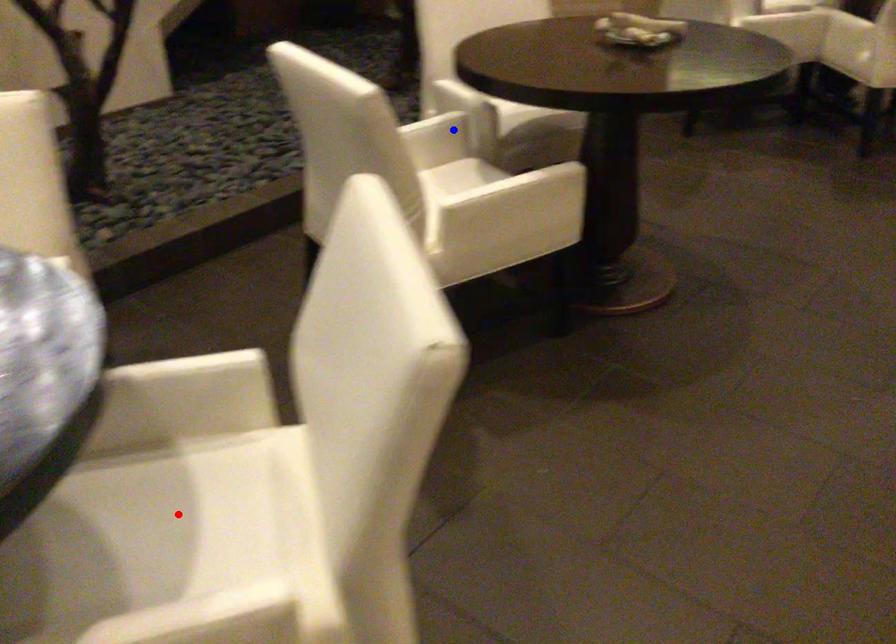
Question: Two points are marked on the image. Which point is closer to the camera?

Choices:
 (A) Blue point is closer.
 (B) Red point is closer.

Answer: (B)